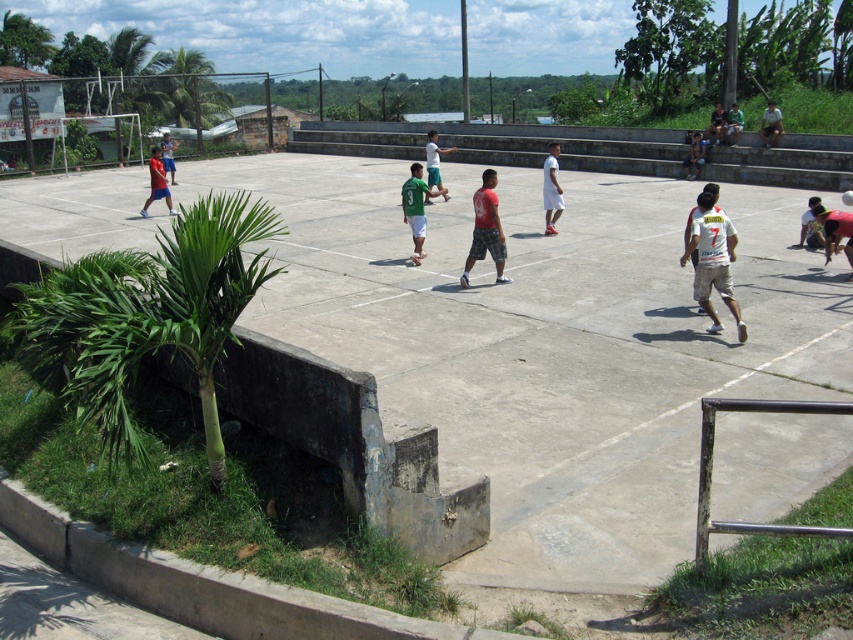
Question: Can you confirm if red matte shorts at center is positioned to the right of reddish-brown skin at lower right?

Choices:
 (A) no
 (B) yes

Answer: (A)

Question: Which of the following is the closest to the observer?

Choices:
 (A) (398, 276)
 (B) (846, 218)
 (C) (498, 225)
 (D) (416, 179)

Answer: (C)

Question: Among these points, which one is nearest to the camera?

Choices:
 (A) tap(849, 259)
 (B) tap(476, 246)

Answer: (A)

Question: From the image, what is the correct spatial relationship of red matte shorts at center in relation to reddish-brown skin at lower right?

Choices:
 (A) right
 (B) left

Answer: (B)

Question: Which object is the closest to the concrete court at center?

Choices:
 (A) red matte shorts at center
 (B) green matte shirt at center
 (C) reddish-brown skin at lower right
 (D) white jersey at right

Answer: (B)

Question: In this image, where is concrete court at center located relative to red matte shorts at center?

Choices:
 (A) right
 (B) left

Answer: (B)